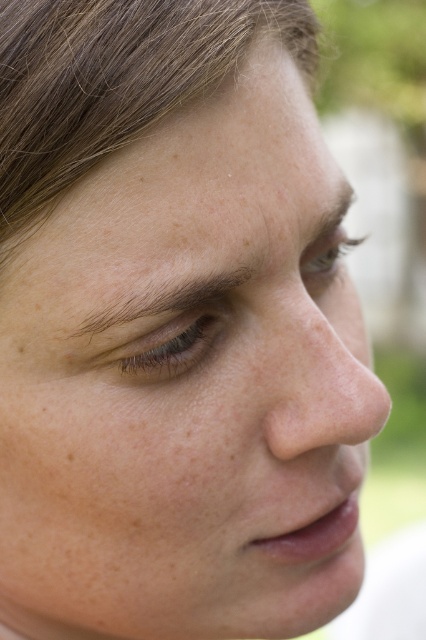
From the picture: Can you confirm if brown smooth hair at upper left is positioned to the right of brown matte eye at center?

Correct, you'll find brown smooth hair at upper left to the right of brown matte eye at center.

Between brown smooth hair at upper left and brown matte eye at center, which one is positioned higher?

Positioned higher is brown smooth hair at upper left.

Is point (5, 84) farther from viewer compared to point (118, 360)?

No, it is not.

Identify the location of brown smooth hair at upper left. (114, 81).

Is brown matte eye at center wider than light brown eye at upper center?

No, brown matte eye at center is not wider than light brown eye at upper center.

Who is more forward, (207, 324) or (322, 250)?

Positioned in front is point (207, 324).

This screenshot has height=640, width=426. In order to click on brown matte eye at center in this screenshot , I will do `click(166, 339)`.

The height and width of the screenshot is (640, 426). Identify the location of brown smooth hair at upper left. (114, 81).

Between brown smooth hair at upper left and brown hair at upper left, which one has more height?

brown smooth hair at upper left is taller.

I want to click on brown smooth hair at upper left, so click(x=114, y=81).